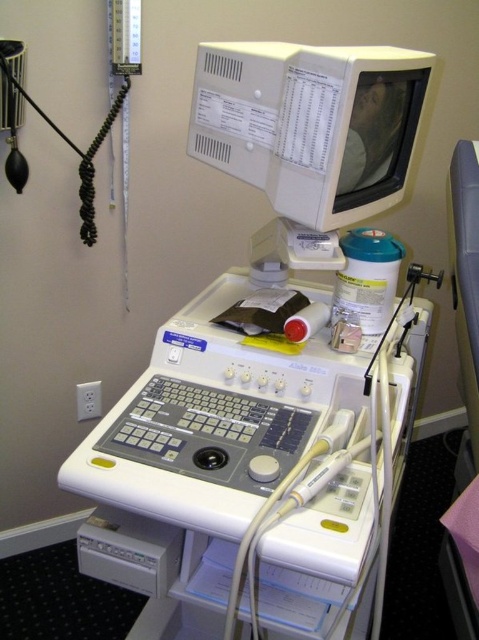
Question: Which of the following is the farthest from the observer?

Choices:
 (A) white plastic ultrasound machine at center
 (B) white plastic monitor at center

Answer: (B)

Question: Can you confirm if white plastic ultrasound machine at center is positioned to the right of white plastic monitor at center?

Choices:
 (A) no
 (B) yes

Answer: (A)

Question: Does white plastic ultrasound machine at center appear on the right side of white plastic monitor at center?

Choices:
 (A) no
 (B) yes

Answer: (A)

Question: Is white plastic ultrasound machine at center to the right of white plastic monitor at center from the viewer's perspective?

Choices:
 (A) yes
 (B) no

Answer: (B)

Question: Which point is closer to the camera?

Choices:
 (A) (304, 81)
 (B) (162, 362)

Answer: (A)